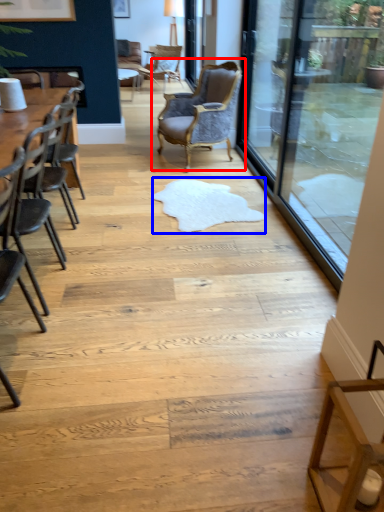
Question: Among these objects, which one is nearest to the camera, chair (highlighted by a red box) or mat (highlighted by a blue box)?

Choices:
 (A) chair
 (B) mat

Answer: (B)